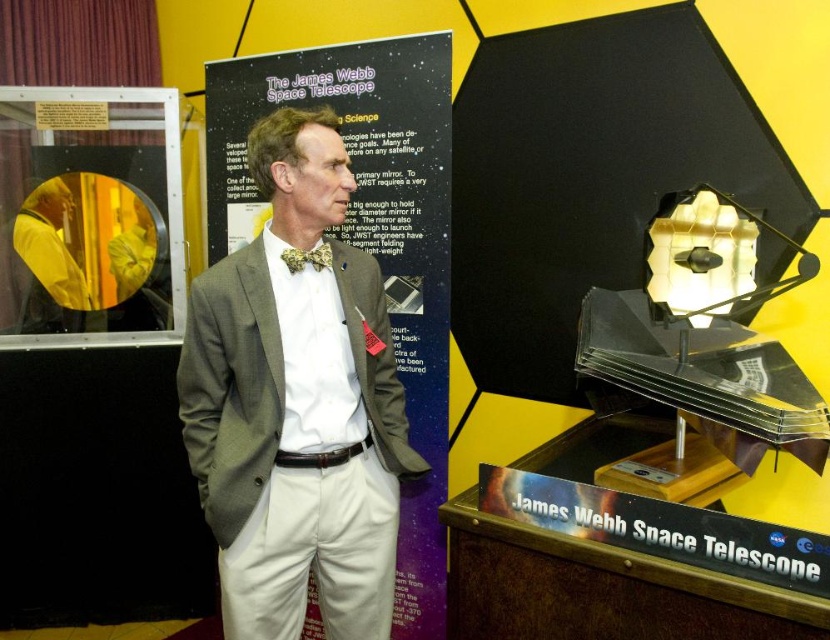
You are an interior designer tasked with arranging the yellow fabric at center and the floral silk bow tie at center in a display case. Which object should be placed first if you want to ensure both fit properly?

The yellow fabric at center should be placed first because it is larger in size than the floral silk bow tie at center, ensuring there is enough space for both items in the display case.

You are an event planner setting up a booth for a space exploration event. You have two items to place on the central display table. The yellow fabric at center and the floral silk bow tie at center. According to the image, which item should be placed on top to create a layered look?

The yellow fabric at center should be placed on top of the floral silk bow tie at center to create the layered look as shown in the image.

You are an assistant at the James Webb Space Telescope exhibition. You need to inform visitors about the positioning of the gray textured suit at center and the yellow fabric at center. Based on the scene description, can you tell me which object is placed lower in the image?

The gray textured suit at center is located below the yellow fabric at center, so the gray textured suit at center is placed lower in the image.